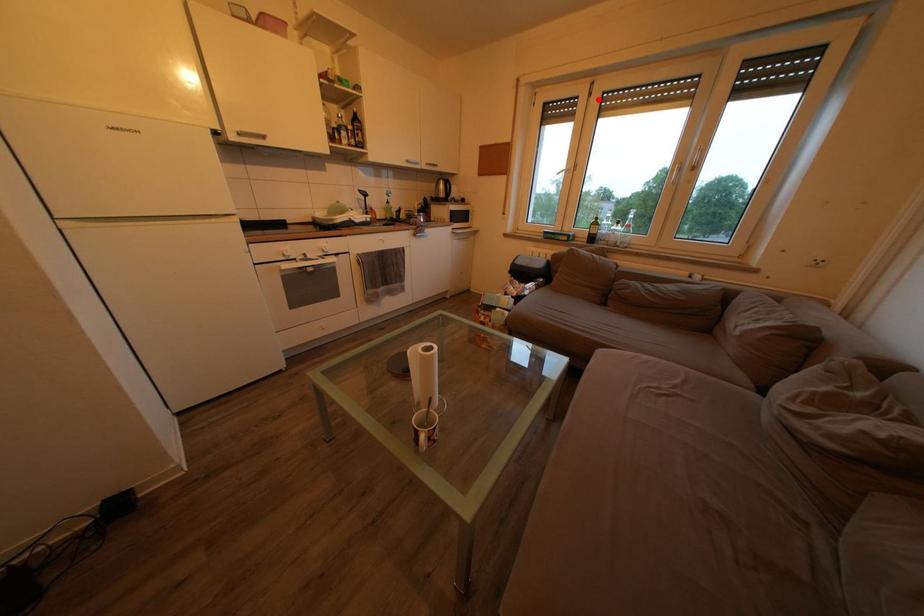
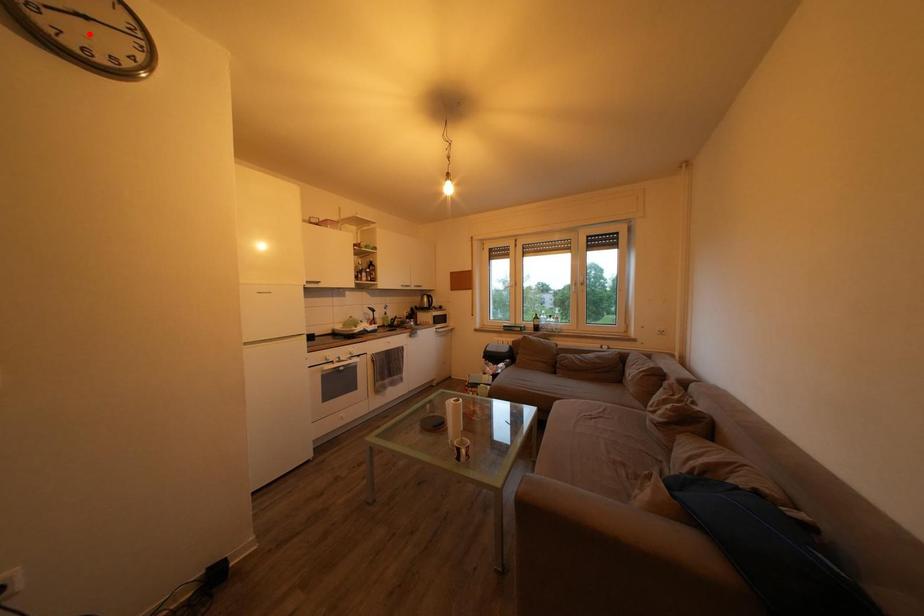
I am providing you with two images of the same scene from different viewpoints. A red point is marked on the first image and another point is marked on the second image. Is the marked point in image1 the same physical position as the marked point in image2?

No